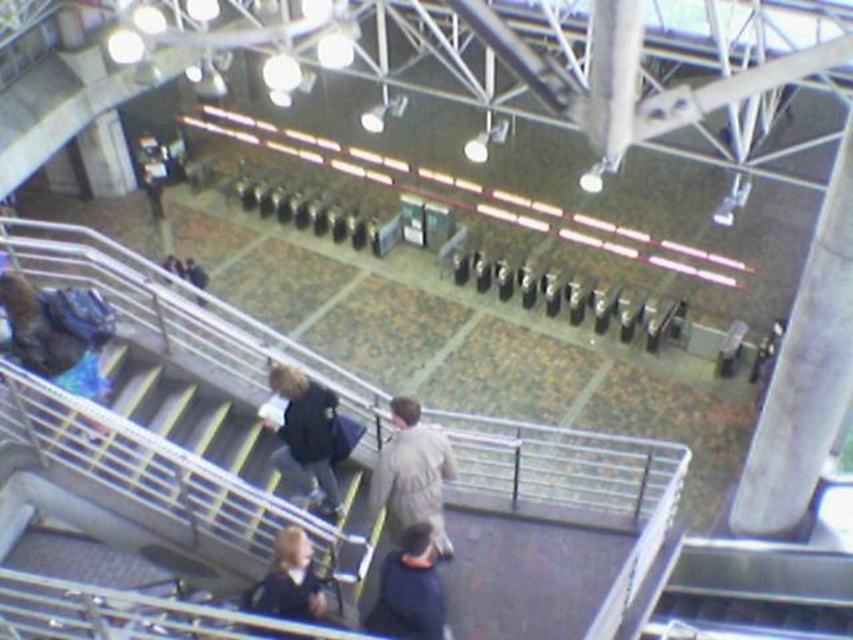
Which is more to the left, dark blue jacket at center or dark blue fabric at lower center?

Positioned to the left is dark blue jacket at center.

Is point (321, 445) positioned before point (408, 609)?

That is False.

This screenshot has width=853, height=640. I want to click on dark blue jacket at center, so click(x=306, y=435).

Measure the distance from light brown fabric jacket at center to dark blue fabric at lower center.

light brown fabric jacket at center and dark blue fabric at lower center are 78.99 centimeters apart from each other.

Can you confirm if light brown fabric jacket at center is shorter than dark blue fabric at lower center?

No.

Which is in front, point (410, 474) or point (375, 605)?

Point (375, 605) is in front.

You are a GUI agent. You are given a task and a screenshot of the screen. Output one action in this format:
    pyautogui.click(x=<x>, y=<y>)
    Task: Click on the light brown fabric jacket at center
    
    Given the screenshot: What is the action you would take?
    pyautogui.click(x=412, y=476)

Does light brown fabric jacket at center have a greater height compared to dark blue jacket at center?

Indeed, light brown fabric jacket at center has a greater height compared to dark blue jacket at center.

Does light brown fabric jacket at center appear on the left side of dark blue jacket at center?

Incorrect, light brown fabric jacket at center is not on the left side of dark blue jacket at center.

Which is in front, point (392, 408) or point (323, 509)?

Point (392, 408) is in front.

Locate an element on the screen. The height and width of the screenshot is (640, 853). light brown fabric jacket at center is located at coordinates click(412, 476).